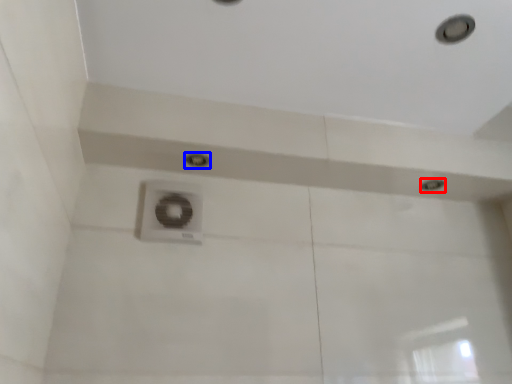
Question: Which object appears closest to the camera in this image, droplight (highlighted by a red box) or droplight (highlighted by a blue box)?

Choices:
 (A) droplight
 (B) droplight

Answer: (B)